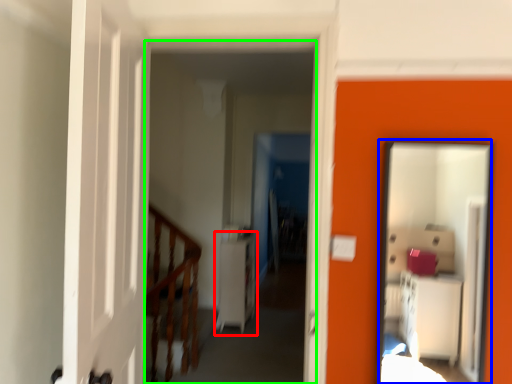
Question: Considering the real-world distances, which object is farthest from dresser (highlighted by a red box)? mirror (highlighted by a blue box) or corridor (highlighted by a green box)?

Choices:
 (A) mirror
 (B) corridor

Answer: (A)